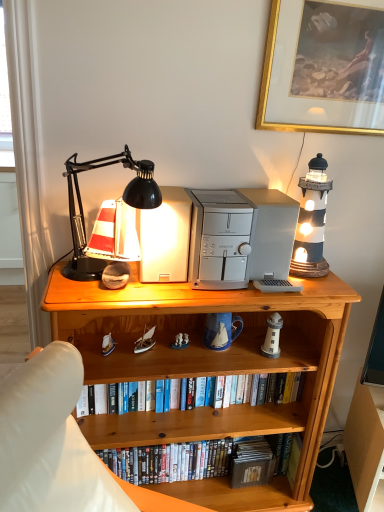
What do you see at coordinates (122, 197) in the screenshot? I see `black matte desk lamp at upper left` at bounding box center [122, 197].

Measure the distance between point (258, 101) and camera.

The distance of point (258, 101) from camera is 4.42 feet.

The width and height of the screenshot is (384, 512). What do you see at coordinates (294, 117) in the screenshot?
I see `gold-framed painting at upper right` at bounding box center [294, 117].

What do you see at coordinates (28, 160) in the screenshot? I see `white fabric curtain at left` at bounding box center [28, 160].

Measure the distance between point (168, 345) and camera.

Point (168, 345) and camera are 4.83 feet apart from each other.

What is the approximate height of white plastic toaster at center, the 1th appliance positioned from the left?

It is 11.24 inches.

Find the location of a particular element. black matte desk lamp at upper left is located at coordinates (122, 197).

What are the coordinates of `computer desk below the black matte desk lamp at upper left (from a real-world perspective)` in the screenshot? It's located at point(365,441).

Is black matte desk lamp at upper left wider or thinner than light brown wood at lower right?

Clearly, black matte desk lamp at upper left has less width compared to light brown wood at lower right.

Is point (80, 258) positioned in front of point (370, 432)?

Yes, it is in front of point (370, 432).

Can silver metallic desktop computer at center, the second appliance from the left, be found inside light brown wood at lower right?

No, silver metallic desktop computer at center, the second appliance from the left, is not surrounded by light brown wood at lower right.

Who is smaller, light brown wood at lower right or silver metallic desktop computer at center, the second appliance from the left?

With smaller size is silver metallic desktop computer at center, the second appliance from the left.

From a real-world perspective, between light brown wood at lower right and silver metallic desktop computer at center, the second appliance from the left, who is vertically higher?

silver metallic desktop computer at center, the second appliance from the left, is physically above.

Is point (288, 51) positioned in front of point (226, 233)?

No, it is not.

Looking at this image, between gold-framed painting at upper right and silver metallic desktop computer at center, acting as the 1th appliance starting from the right, which one has smaller size?

With smaller size is gold-framed painting at upper right.

Can you tell me how much gold-framed painting at upper right and silver metallic desktop computer at center, the second appliance from the left, differ in facing direction?

The angular difference between gold-framed painting at upper right and silver metallic desktop computer at center, the second appliance from the left, is 0.858 degrees.

In the scene shown: Is gold-framed painting at upper right not inside light brown wood at lower right?

That's correct, gold-framed painting at upper right is outside of light brown wood at lower right.

From a real-world perspective, is gold-framed painting at upper right physically above light brown wood at lower right?

Yes, from a real-world perspective, gold-framed painting at upper right is over light brown wood at lower right

Can you confirm if gold-framed painting at upper right is smaller than light brown wood at lower right?

Correct, gold-framed painting at upper right occupies less space than light brown wood at lower right.

Looking at this image, in terms of height, does gold-framed painting at upper right look taller or shorter compared to light brown wood at lower right?

Clearly, gold-framed painting at upper right is shorter compared to light brown wood at lower right.

Which object is wider, white plastic toaster at center, the 1th appliance positioned from the left, or white fabric curtain at left?

white plastic toaster at center, the 1th appliance positioned from the left, is wider.

Which of these two, white plastic toaster at center, the 1th appliance positioned from the left, or white fabric curtain at left, stands taller?

Standing taller between the two is white fabric curtain at left.

Could you tell me if white plastic toaster at center, the 1th appliance positioned from the left, is facing white fabric curtain at left?

No, white plastic toaster at center, the 1th appliance positioned from the left, is not turned towards white fabric curtain at left.

Is the position of white plastic toaster at center, positioned as the 2th appliance in right-to-left order, more distant than that of white fabric curtain at left?

Yes, white plastic toaster at center, positioned as the 2th appliance in right-to-left order, is behind white fabric curtain at left.

Is silver metallic desktop computer at center, acting as the 1th appliance starting from the right, positioned before white fabric curtain at left?

No, the depth of silver metallic desktop computer at center, acting as the 1th appliance starting from the right, is greater than that of white fabric curtain at left.

Which of these two, silver metallic desktop computer at center, the second appliance from the left, or white fabric curtain at left, is smaller?

Smaller between the two is silver metallic desktop computer at center, the second appliance from the left.

Considering the sizes of objects silver metallic desktop computer at center, the second appliance from the left, and white fabric curtain at left in the image provided, who is thinner, silver metallic desktop computer at center, the second appliance from the left, or white fabric curtain at left?

With smaller width is white fabric curtain at left.

From a real-world perspective, which object stands above the other?

silver metallic desktop computer at center, acting as the 1th appliance starting from the right, from a real-world perspective.

Is black matte desk lamp at upper left turned away from wooden bookcase at center?

No, black matte desk lamp at upper left is not facing the opposite direction of wooden bookcase at center.

From a real-world perspective, is black matte desk lamp at upper left positioned under wooden bookcase at center based on gravity?

Actually, black matte desk lamp at upper left is physically above wooden bookcase at center in the real world.

Is black matte desk lamp at upper left bigger than wooden bookcase at center?

Incorrect, black matte desk lamp at upper left is not larger than wooden bookcase at center.

Does black matte desk lamp at upper left have a lesser width compared to wooden bookcase at center?

Yes.

What are the coordinates of `lamp that appears in front of the light brown wood at lower right` in the screenshot? It's located at (122, 197).

You are a GUI agent. You are given a task and a screenshot of the screen. Output one action in this format:
    pyautogui.click(x=<x>, y=<y>)
    Task: Click on the 1st appliance above the light brown wood at lower right (from the image's perspective)
    The width and height of the screenshot is (384, 512).
    Given the screenshot: What is the action you would take?
    pyautogui.click(x=239, y=237)

Based on their spatial positions, is silver metallic desktop computer at center, the second appliance from the left, or gold-framed painting at upper right further from black matte desk lamp at upper left?

Among the two, gold-framed painting at upper right is located further to black matte desk lamp at upper left.

Based on their spatial positions, is gold-framed painting at upper right or light brown wood at lower right further from wooden bookcase at center?

gold-framed painting at upper right.

Looking at the image, which one is located closer to gold-framed painting at upper right, black matte desk lamp at upper left or white fabric curtain at left?

Among the two, black matte desk lamp at upper left is located nearer to gold-framed painting at upper right.

Which object lies nearer to the anchor point black matte desk lamp at upper left, light brown wood at lower right or white fabric curtain at left?

white fabric curtain at left is positioned closer to the anchor black matte desk lamp at upper left.

From the image, which object appears to be farther from white fabric curtain at left, light brown wood at lower right or wooden bookcase at center?

light brown wood at lower right.

Which object lies nearer to the anchor point wooden bookcase at center, light brown wood at lower right or silver metallic desktop computer at center, the second appliance from the left?

silver metallic desktop computer at center, the second appliance from the left.

Considering their positions, is silver metallic desktop computer at center, acting as the 1th appliance starting from the right, positioned closer to black matte desk lamp at upper left than white fabric curtain at left?

Based on the image, white fabric curtain at left appears to be nearer to black matte desk lamp at upper left.

From the image, which object appears to be nearer to light brown wood at lower right, silver metallic desktop computer at center, the second appliance from the left, or gold-framed painting at upper right?

silver metallic desktop computer at center, the second appliance from the left, lies closer to light brown wood at lower right than the other object.

Identify the location of lamp between white fabric curtain at left and white plastic toaster at center, positioned as the 2th appliance in right-to-left order. The height and width of the screenshot is (512, 384). (122, 197).

I want to click on bookcase that lies between gold-framed painting at upper right and light brown wood at lower right from top to bottom, so click(208, 367).

The height and width of the screenshot is (512, 384). I want to click on bookcase situated between white plastic toaster at center, the 1th appliance positioned from the left, and light brown wood at lower right from left to right, so click(208, 367).

Locate an element on the screen. lamp located between white fabric curtain at left and light brown wood at lower right in the left-right direction is located at coordinates (122, 197).